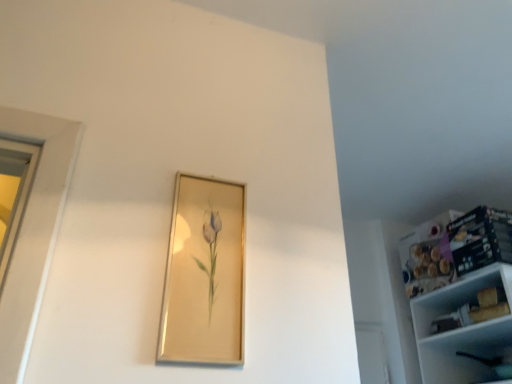
In order to click on gold metallic picture frame at center in this screenshot , I will do `click(205, 274)`.

The image size is (512, 384). Describe the element at coordinates (205, 274) in the screenshot. I see `gold metallic picture frame at center` at that location.

Find the location of a particular element. The width and height of the screenshot is (512, 384). gold metallic picture frame at center is located at coordinates (205, 274).